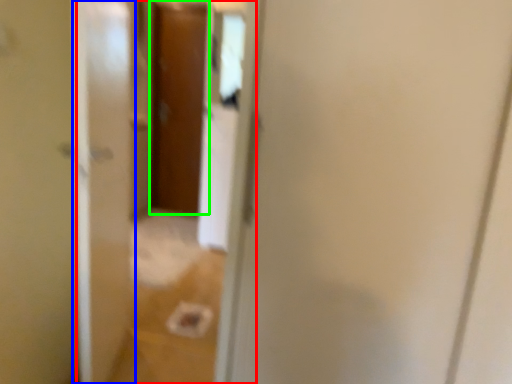
Question: Estimate the real-world distances between objects in this image. Which object is farther from glass door (highlighted by a red box), screen door (highlighted by a blue box) or door (highlighted by a green box)?

Choices:
 (A) screen door
 (B) door

Answer: (B)